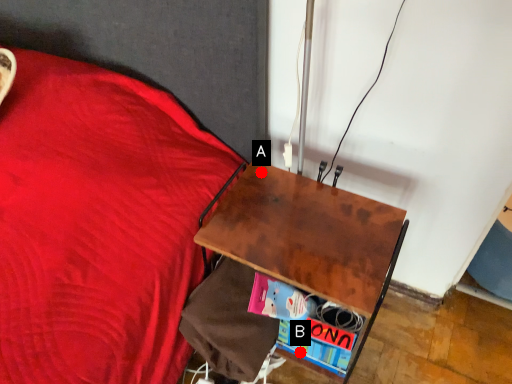
Question: Two points are circled on the image, labeled by A and B beside each circle. Among these points, which one is nearest to the camera?

Choices:
 (A) A is closer
 (B) B is closer

Answer: (B)